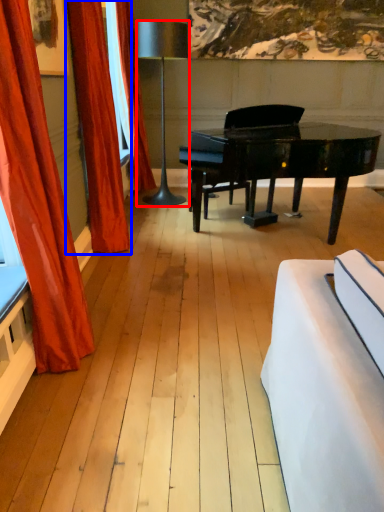
Question: Which of the following is the farthest to the observer, lamp (highlighted by a red box) or curtain (highlighted by a blue box)?

Choices:
 (A) lamp
 (B) curtain

Answer: (A)